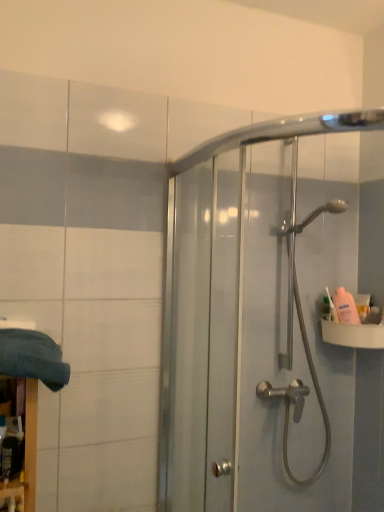
Question: Is there a large distance between white plastic sink at right and dark blue fabric at lower left?

Choices:
 (A) no
 (B) yes

Answer: (B)

Question: Is white plastic sink at right taller than dark blue fabric at lower left?

Choices:
 (A) no
 (B) yes

Answer: (A)

Question: Is white plastic sink at right oriented towards dark blue fabric at lower left?

Choices:
 (A) no
 (B) yes

Answer: (A)

Question: Is white plastic sink at right smaller than dark blue fabric at lower left?

Choices:
 (A) yes
 (B) no

Answer: (A)

Question: Does white plastic sink at right have a greater width compared to dark blue fabric at lower left?

Choices:
 (A) yes
 (B) no

Answer: (B)

Question: Can you confirm if white plastic sink at right is shorter than dark blue fabric at lower left?

Choices:
 (A) no
 (B) yes

Answer: (B)

Question: Is clear glass shower door at upper right smaller than pink plastic bottle at right?

Choices:
 (A) no
 (B) yes

Answer: (A)

Question: From a real-world perspective, does clear glass shower door at upper right sit lower than pink plastic bottle at right?

Choices:
 (A) no
 (B) yes

Answer: (A)

Question: Is clear glass shower door at upper right not within pink plastic bottle at right?

Choices:
 (A) no
 (B) yes

Answer: (B)

Question: Is clear glass shower door at upper right positioned with its back to pink plastic bottle at right?

Choices:
 (A) yes
 (B) no

Answer: (A)

Question: Can you see clear glass shower door at upper right touching pink plastic bottle at right?

Choices:
 (A) no
 (B) yes

Answer: (A)

Question: Considering the relative positions of clear glass shower door at upper right and pink plastic bottle at right in the image provided, is clear glass shower door at upper right to the right of pink plastic bottle at right from the viewer's perspective?

Choices:
 (A) yes
 (B) no

Answer: (B)

Question: Is pink plastic bottle at right to the right of white plastic sink at right from the viewer's perspective?

Choices:
 (A) no
 (B) yes

Answer: (A)